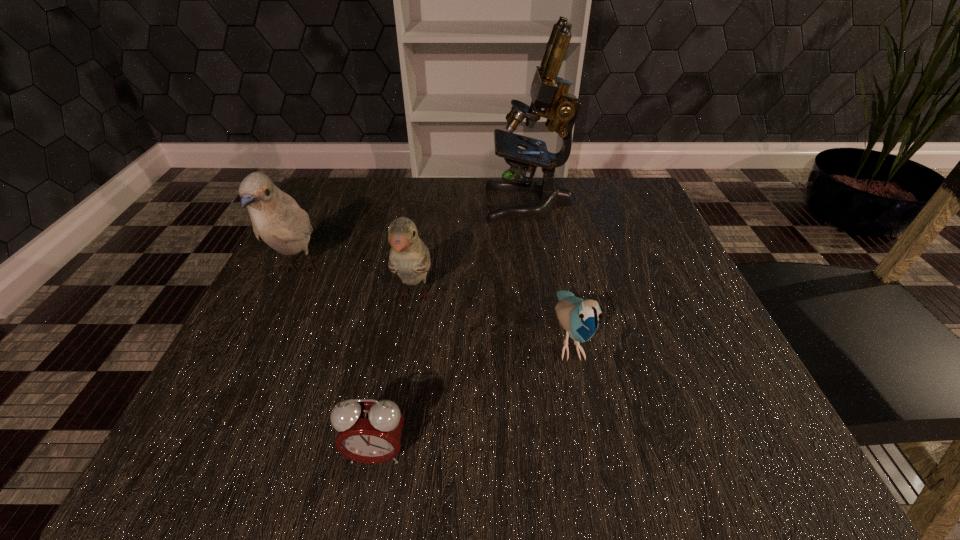
You are a GUI agent. You are given a task and a screenshot of the screen. Output one action in this format:
    pyautogui.click(x=<x>, y=<y>)
    Task: Click on the tallest object
    
    Given the screenshot: What is the action you would take?
    pyautogui.click(x=548, y=91)

Locate an element on the screen. Image resolution: width=960 pixels, height=540 pixels. the farthest object is located at coordinates (548, 91).

Image resolution: width=960 pixels, height=540 pixels. What are the coordinates of `the leftmost object` in the screenshot? It's located at (277, 219).

Locate an element on the screen. the tallest bird is located at coordinates (277, 219).

You are a GUI agent. You are given a task and a screenshot of the screen. Output one action in this format:
    pyautogui.click(x=<x>, y=<y>)
    Task: Click on the second shortest bird
    The height and width of the screenshot is (540, 960).
    Given the screenshot: What is the action you would take?
    pyautogui.click(x=409, y=257)

The width and height of the screenshot is (960, 540). I want to click on the second bird from right to left, so click(x=409, y=257).

In order to click on the fourth tallest object in this screenshot , I will do `click(580, 318)`.

Where is `the rightmost bird`? Image resolution: width=960 pixels, height=540 pixels. the rightmost bird is located at coordinates (580, 318).

What are the coordinates of `the shortest object` in the screenshot? It's located at [370, 431].

Locate an element on the screen. the nearest object is located at coordinates (370, 431).